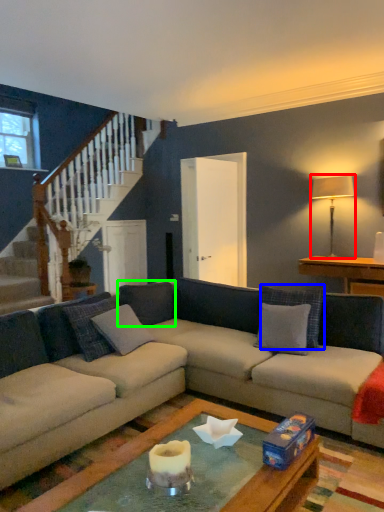
Question: Which object is positioned farthest from lamp (highlighted by a red box)? Select from pillow (highlighted by a blue box) and pillow (highlighted by a green box).

Choices:
 (A) pillow
 (B) pillow

Answer: (B)